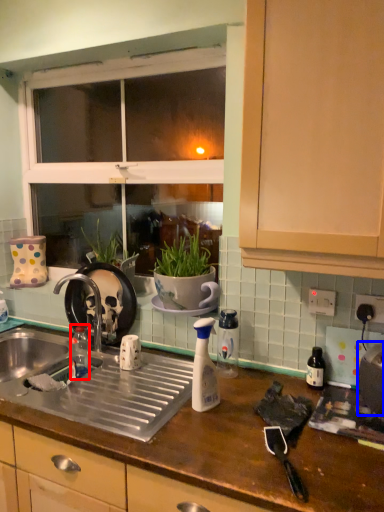
Question: Which object appears farthest to the camera in this image, bottle (highlighted by a red box) or appliance (highlighted by a blue box)?

Choices:
 (A) bottle
 (B) appliance

Answer: (A)